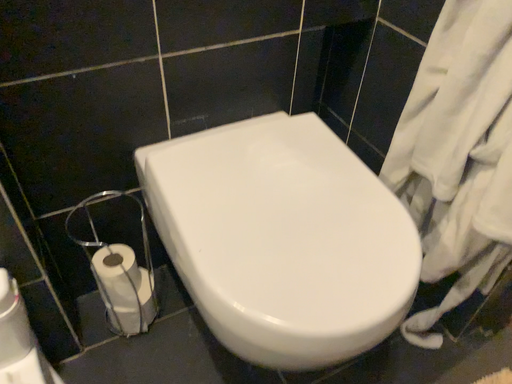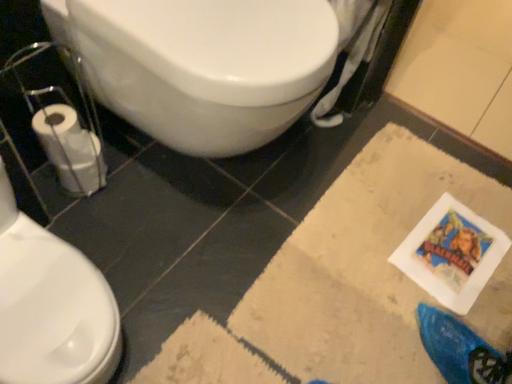
Question: How did the camera likely rotate when shooting the video?

Choices:
 (A) rotated upward
 (B) rotated downward

Answer: (B)